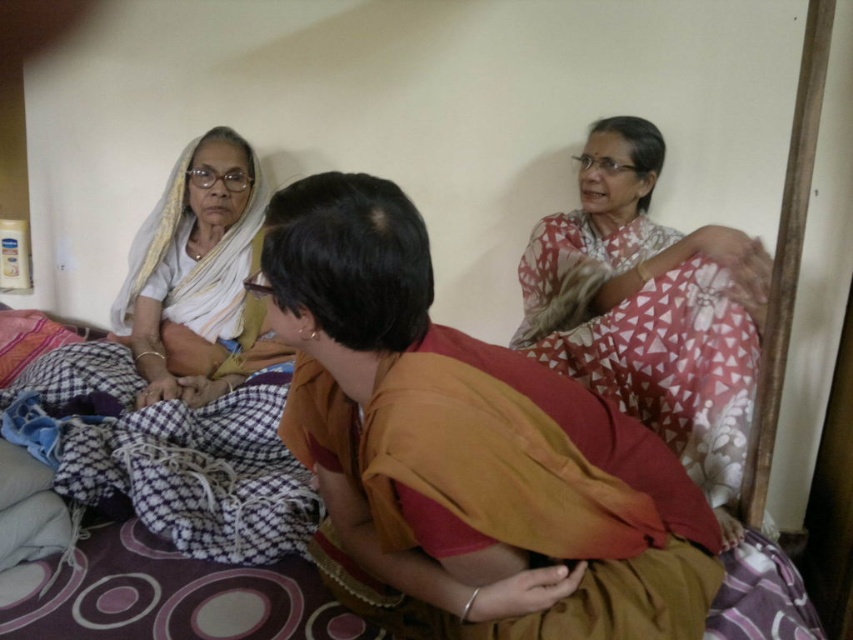
Question: Which object is closer to the camera taking this photo?

Choices:
 (A) orange cotton saree at center
 (B) white fabric sari at left

Answer: (A)

Question: Which point appears farthest from the camera in this image?

Choices:
 (A) 241,141
 (B) 685,285
 (C) 102,422
 (D) 331,252

Answer: (A)

Question: Does orange cotton saree at center appear over checkered fabric at lower left?

Choices:
 (A) no
 (B) yes

Answer: (B)

Question: Can you confirm if printed cotton saree at upper right is positioned above white fabric sari at left?

Choices:
 (A) no
 (B) yes

Answer: (A)

Question: Which object appears closest to the camera in this image?

Choices:
 (A) printed cotton saree at upper right
 (B) checkered fabric at lower left

Answer: (B)

Question: Is orange cotton saree at center positioned behind printed cotton saree at upper right?

Choices:
 (A) no
 (B) yes

Answer: (A)